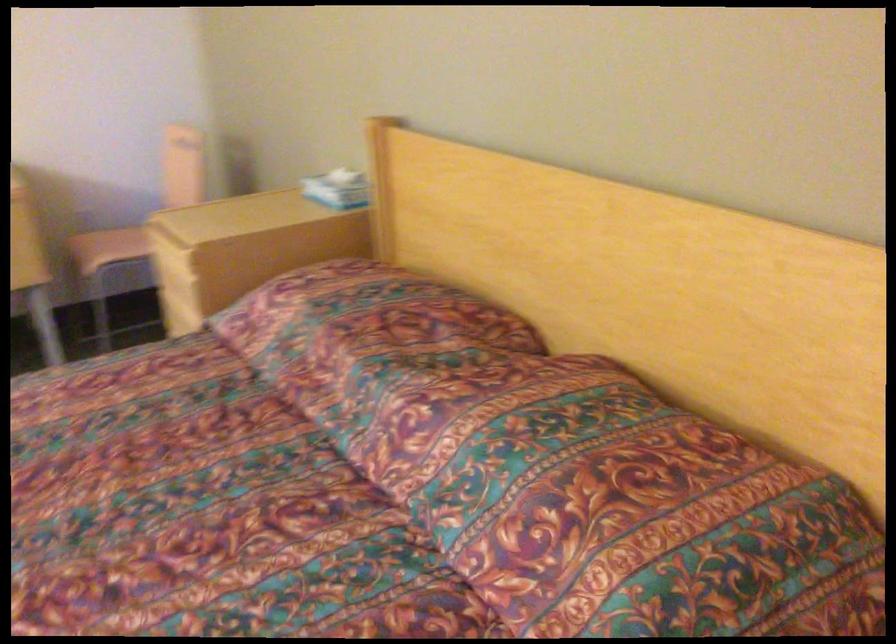
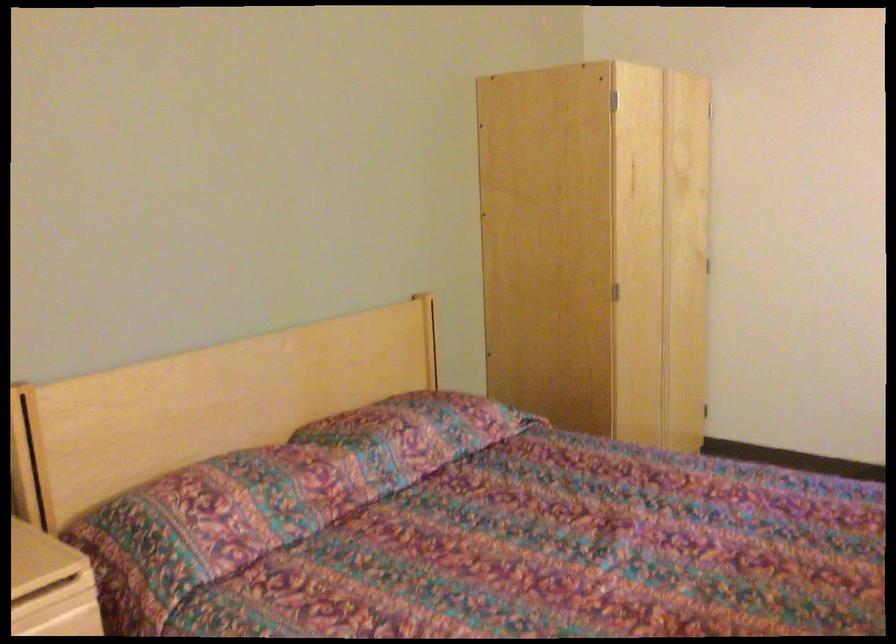
In the second image, find the point that corresponds to [280,298] in the first image.

(211, 518)